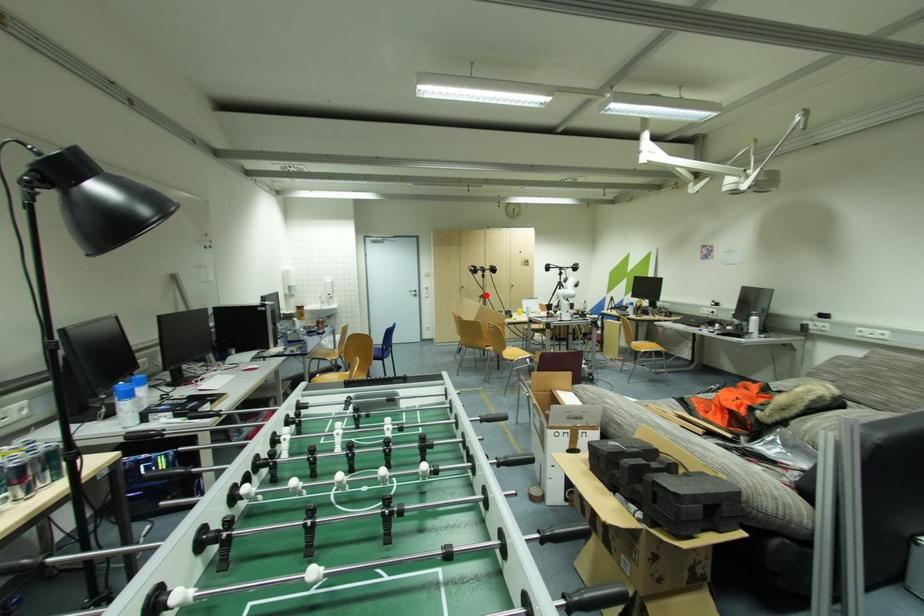
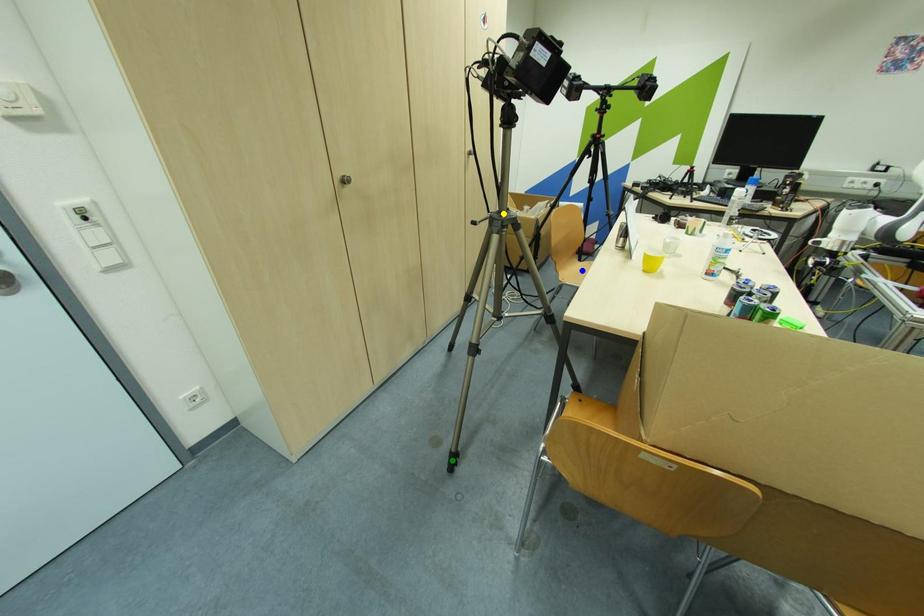
Question: I am providing you with two images of the same scene from different viewpoints. A red point is marked on the first image. You are given multiple points on the second image. In image 2, which mark is for the same physical point as the one in image 1?

Choices:
 (A) yellow point
 (B) blue point
 (C) green point

Answer: (A)